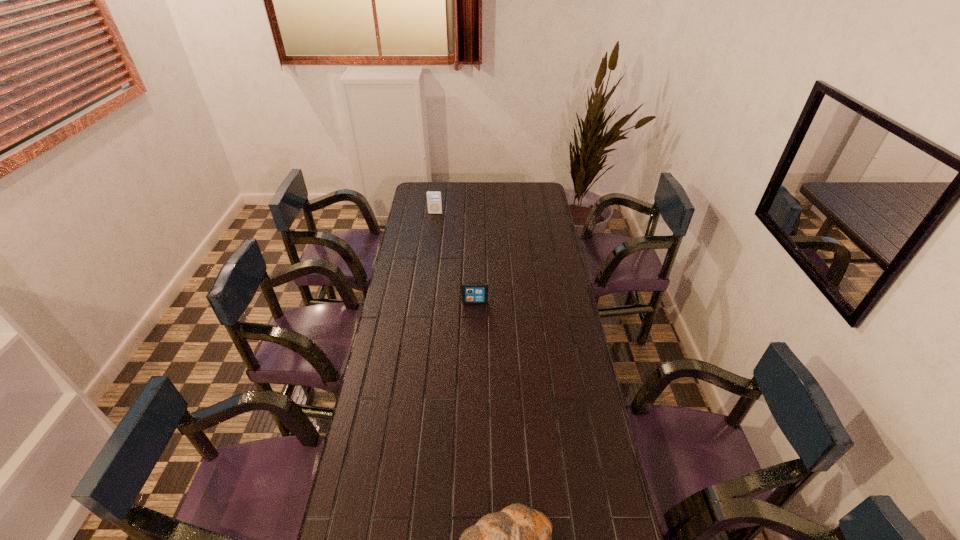
Locate an element on the screen. Image resolution: width=960 pixels, height=540 pixels. free point between the nearer iPod and the farther iPod is located at coordinates (455, 258).

Locate an element on the screen. This screenshot has height=540, width=960. free space between the nearer iPod and the left iPod is located at coordinates (455, 258).

What are the coordinates of `the third closest object relative to the taller iPod` in the screenshot? It's located at (359, 539).

At what (x,y) coordinates should I click in order to perform the action: click on the third closest object to the watch. Please return your answer as a coordinate pair (x, y). This screenshot has height=540, width=960. Looking at the image, I should click on (434, 201).